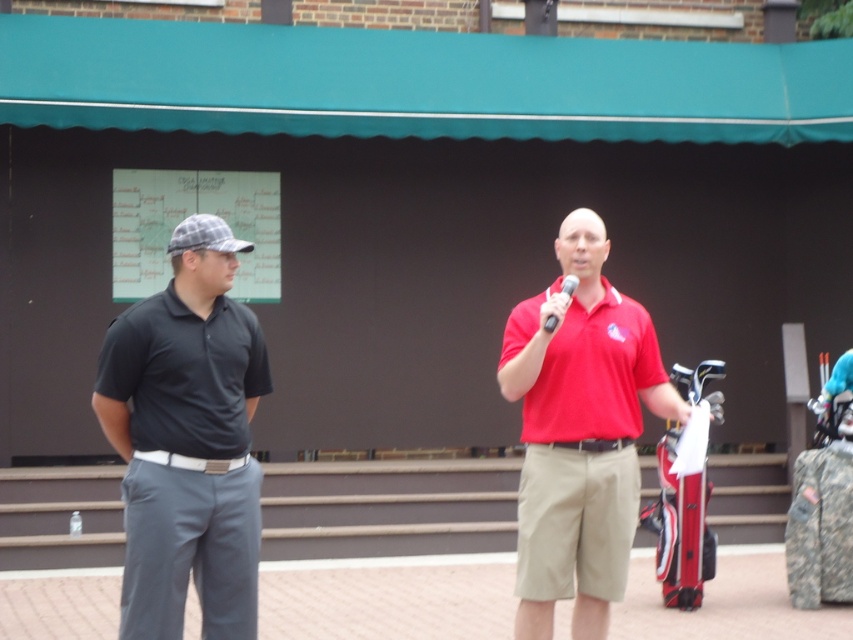
You are a photographer at a golf event and need to capture a clear photo of the matte red shirt at center and the metallic silver microphone at center. Which object should you zoom in on to ensure it fills the frame more without moving the camera?

The matte red shirt at center is larger in size than the metallic silver microphone at center, so you should zoom in on the matte red shirt at center to ensure it fills the frame more without moving the camera.